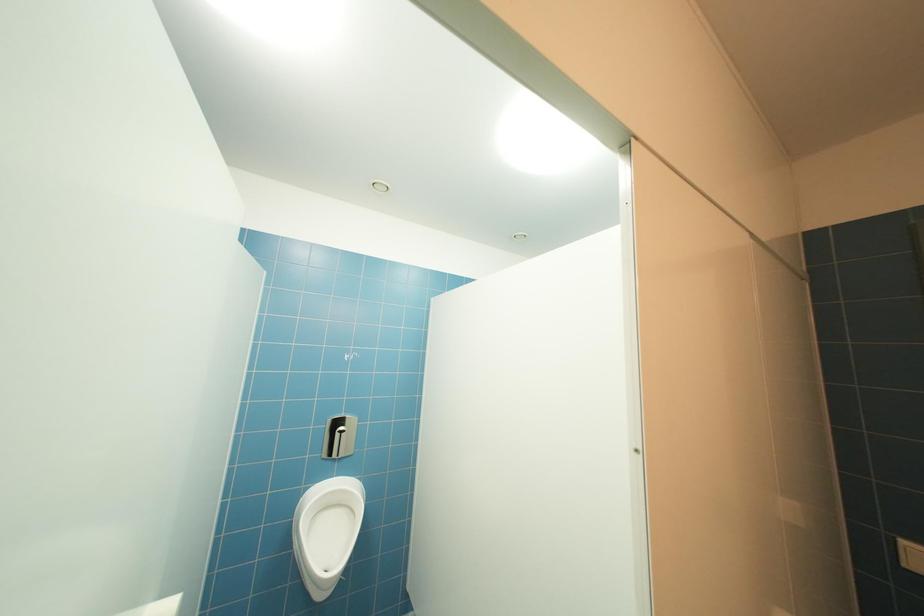
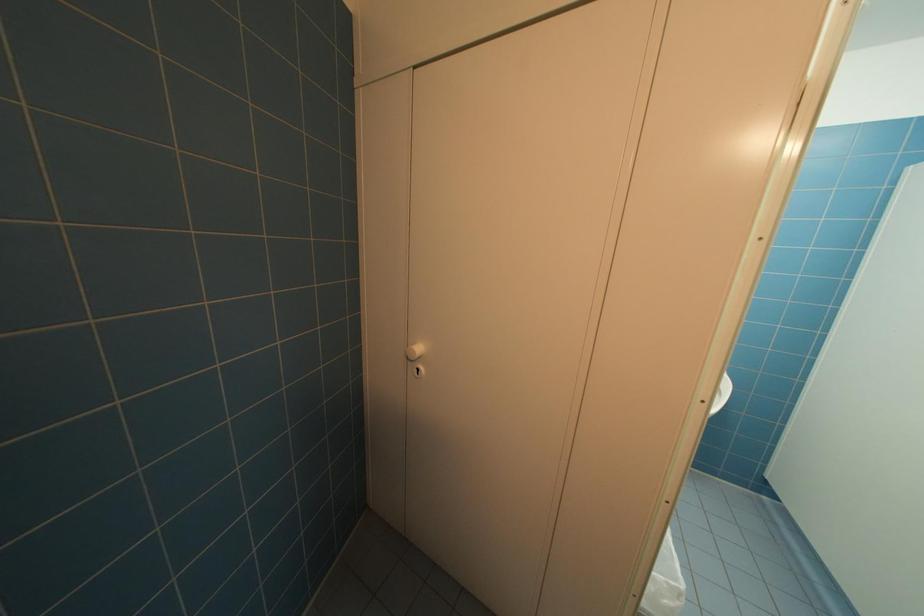
How did the camera likely rotate?

The camera rotated toward left-down.